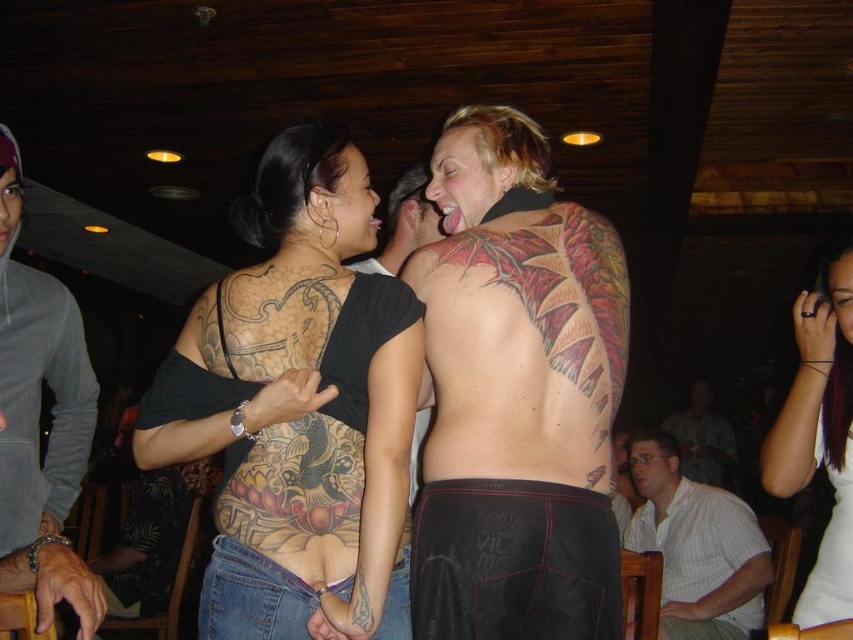
You are a photographer at this event and want to capture a photo of both the purple hair at upper right and the dark brown skin tattoo at upper center. Based on their positions, can you frame them in the same shot without moving either subject?

The purple hair at upper right is located below the dark brown skin tattoo at upper center, so yes, they can be framed together in the same shot as their vertical positions allow both to be included in the frame.

You are at a party and need to sit down. You see a white striped shirt at lower right and a light brown wood chair at lower right. Which object is closer to the left side of the room?

The white striped shirt at lower right is to the left of the light brown wood chair at lower right, so it is closer to the left side of the room.